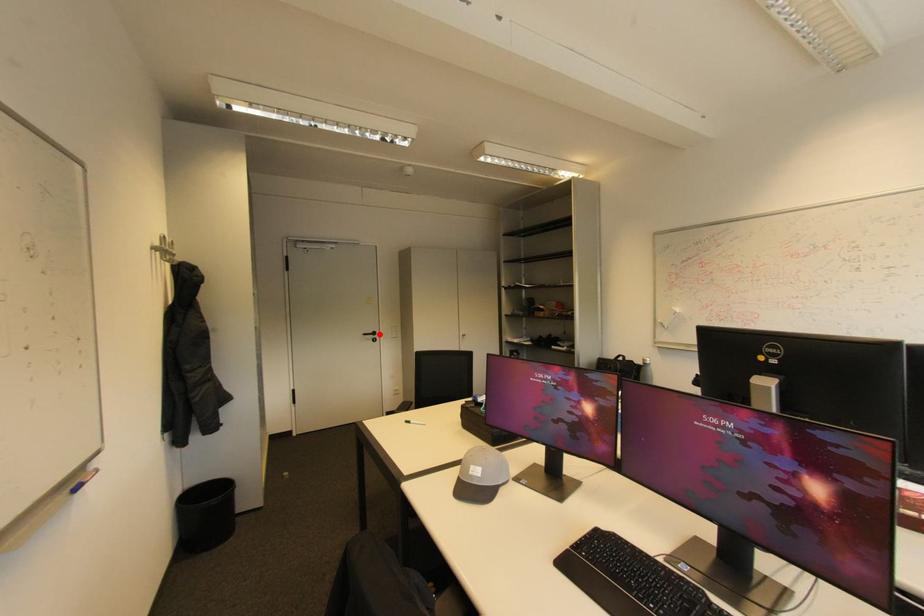
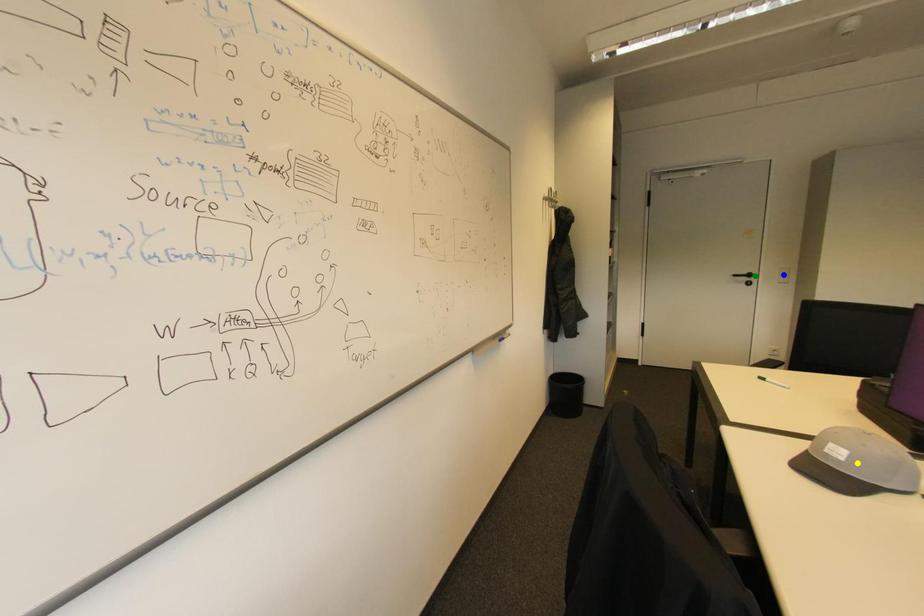
Question: I am providing you with two images of the same scene from different viewpoints. A red point is marked on the first image. You are given multiple points on the second image. In image 2, which mark is for the same physical point as the one in image 1?

Choices:
 (A) blue point
 (B) yellow point
 (C) green point

Answer: (C)